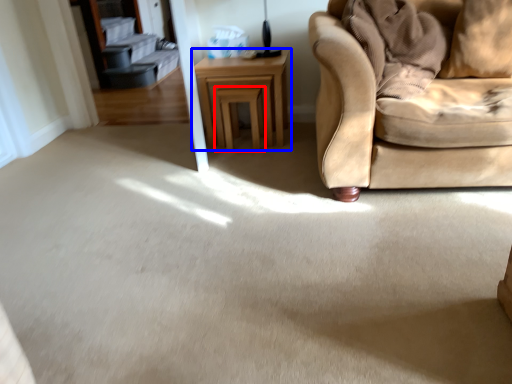
Question: Which object is closer to the camera taking this photo, stool (highlighted by a red box) or table (highlighted by a blue box)?

Choices:
 (A) stool
 (B) table

Answer: (B)